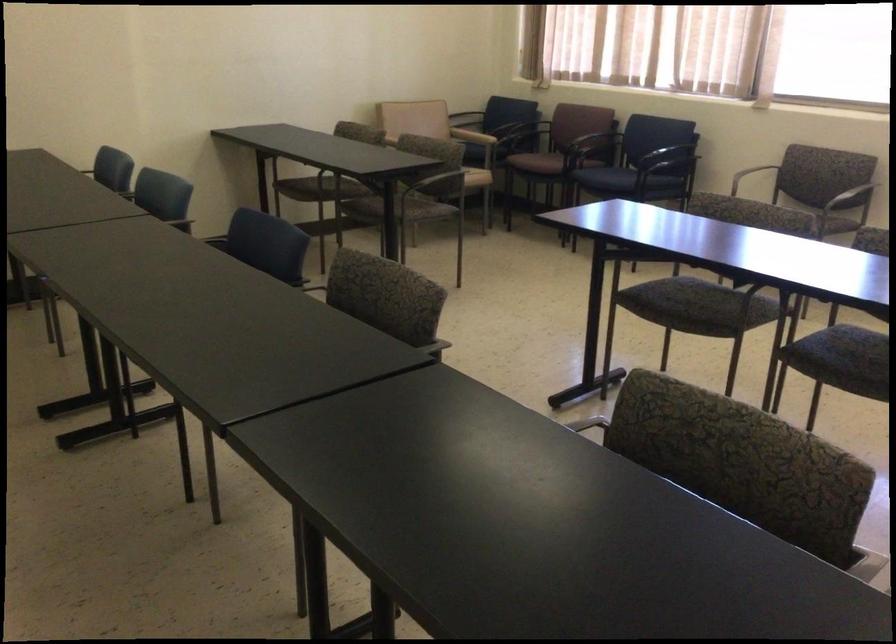
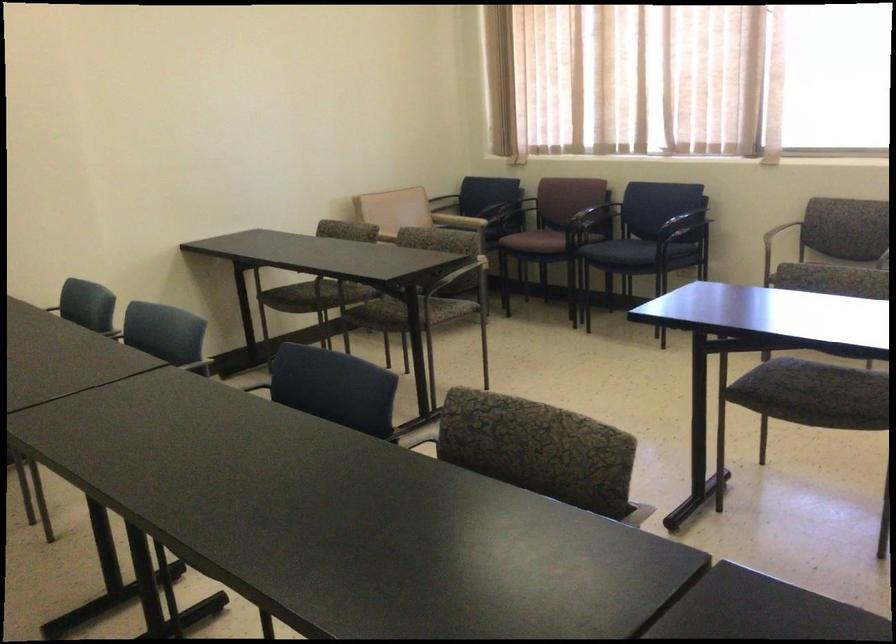
Question: The camera is either moving clockwise (left) or counter-clockwise (right) around the object. The first image is from the beginning of the video and the second image is from the end. Is the camera moving left or right when shooting the video?

Choices:
 (A) Left
 (B) Right

Answer: (A)